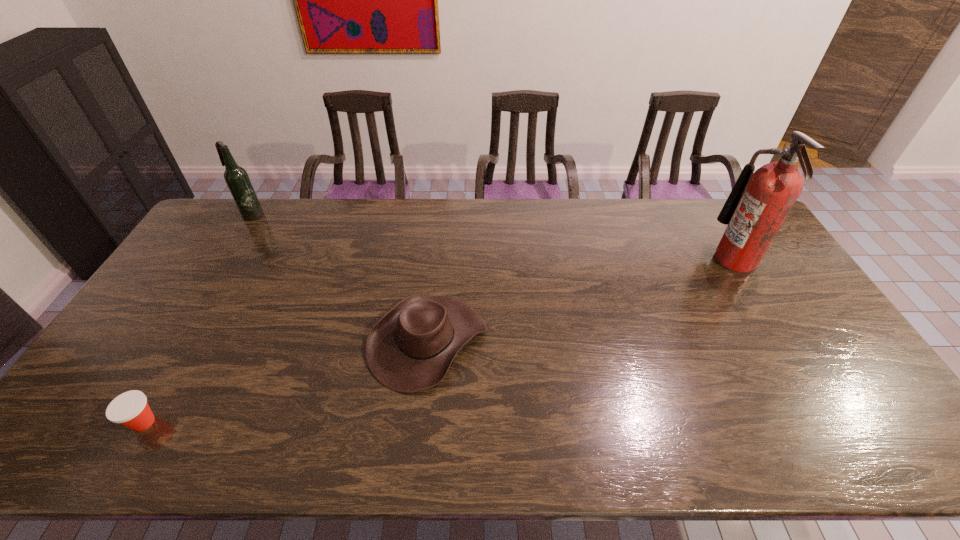
The image size is (960, 540). What are the coordinates of `vacant region between the cowboy hat and the tallest object` in the screenshot? It's located at (582, 300).

Find the location of `unoccupied position between the beer bottle and the Dixie cup`. unoccupied position between the beer bottle and the Dixie cup is located at coordinates (198, 319).

Locate an element on the screen. This screenshot has width=960, height=540. free spot between the fire extinguisher and the cowboy hat is located at coordinates (582, 300).

At what (x,y) coordinates should I click in order to perform the action: click on vacant space that is in between the cowboy hat and the third nearest object. Please return your answer as a coordinate pair (x, y). The width and height of the screenshot is (960, 540). Looking at the image, I should click on (582, 300).

At what (x,y) coordinates should I click in order to perform the action: click on object that stands as the third closest to the shortest object. Please return your answer as a coordinate pair (x, y). The height and width of the screenshot is (540, 960). Looking at the image, I should click on (760, 201).

Point out which object is positioned as the second nearest to the second object from right to left. Please provide its 2D coordinates. Your answer should be formatted as a tuple, i.e. [(x, y)], where the tuple contains the x and y coordinates of a point satisfying the conditions above.

[(237, 179)]

Identify the location of vacant position in the image that satisfies the following two spatial constraints: 1. on the front of the third nearest object near the operation label; 2. on the front side of the nearest object. (832, 422).

The image size is (960, 540). In order to click on free space that satisfies the following two spatial constraints: 1. on the front of the fire extinguisher near the operation label; 2. on the front side of the third farthest object in this screenshot , I will do `click(783, 341)`.

Locate an element on the screen. This screenshot has height=540, width=960. vacant point that satisfies the following two spatial constraints: 1. on the front side of the beer bottle; 2. on the right side of the Dixie cup is located at coordinates (126, 422).